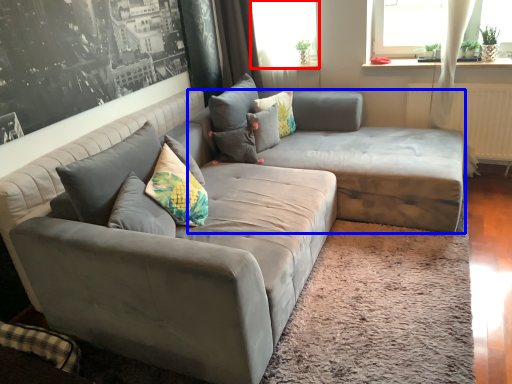
Question: Which object appears closest to the camera in this image, window screen (highlighted by a red box) or couch (highlighted by a blue box)?

Choices:
 (A) window screen
 (B) couch

Answer: (B)